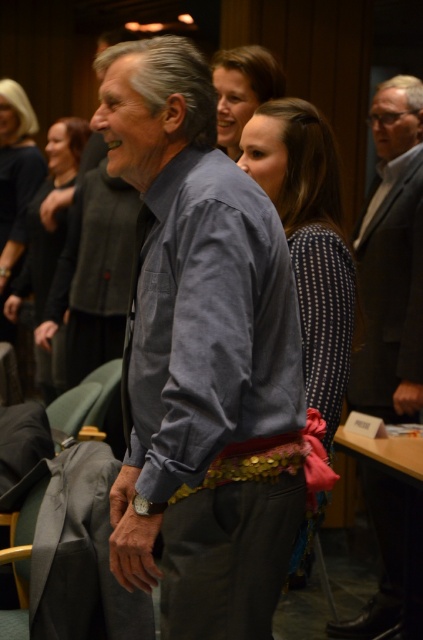
Question: In this image, where is gray cotton shirt at center located relative to polka dot blouse at center?

Choices:
 (A) left
 (B) right

Answer: (B)

Question: Is polka dot blouse at center thinner than dark blue sweater at upper left?

Choices:
 (A) no
 (B) yes

Answer: (A)

Question: Does denim shirt at center have a lesser width compared to matte black dress at center?

Choices:
 (A) no
 (B) yes

Answer: (B)

Question: Which of these objects is positioned closest to the polka dot blouse at center?

Choices:
 (A) smooth brown hair at upper center
 (B) matte black dress at center

Answer: (A)

Question: Which point appears closest to the camera in this image?

Choices:
 (A) (417, 353)
 (B) (173, 481)
 (C) (63, 212)
 (D) (253, 81)

Answer: (B)

Question: Which point appears farthest from the camera in this image?

Choices:
 (A) (318, 124)
 (B) (38, 177)

Answer: (B)